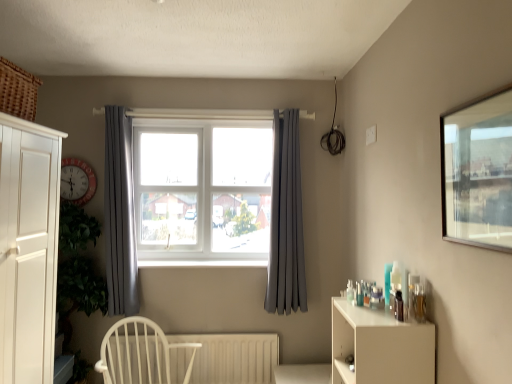
Question: Is white wood chair at lower left outside white plastic radiator at lower center?

Choices:
 (A) yes
 (B) no

Answer: (A)

Question: Is white wood chair at lower left with white plastic radiator at lower center?

Choices:
 (A) yes
 (B) no

Answer: (A)

Question: Is white wood chair at lower left turned away from white plastic radiator at lower center?

Choices:
 (A) yes
 (B) no

Answer: (A)

Question: Is white wood chair at lower left bigger than white plastic radiator at lower center?

Choices:
 (A) yes
 (B) no

Answer: (A)

Question: Does white wood chair at lower left have a greater width compared to white plastic radiator at lower center?

Choices:
 (A) no
 (B) yes

Answer: (B)

Question: Could you tell me if white wood chair at lower left is turned towards white plastic radiator at lower center?

Choices:
 (A) no
 (B) yes

Answer: (A)

Question: Is white plastic window at center far from white plastic radiator at lower center?

Choices:
 (A) no
 (B) yes

Answer: (A)

Question: Considering the relative positions of white plastic window at center and white plastic radiator at lower center in the image provided, is white plastic window at center in front of white plastic radiator at lower center?

Choices:
 (A) no
 (B) yes

Answer: (A)

Question: Can you confirm if white plastic window at center is wider than white plastic radiator at lower center?

Choices:
 (A) no
 (B) yes

Answer: (B)

Question: Does white plastic window at center have a larger size compared to white plastic radiator at lower center?

Choices:
 (A) yes
 (B) no

Answer: (A)

Question: Is white plastic window at center facing away from white plastic radiator at lower center?

Choices:
 (A) yes
 (B) no

Answer: (B)

Question: Could you tell me if white plastic window at center is turned towards white plastic radiator at lower center?

Choices:
 (A) yes
 (B) no

Answer: (B)

Question: From the image's perspective, is white wood chair at lower left located beneath satin grey curtain at center, which appears as the 1th curtain when viewed from the right?

Choices:
 (A) no
 (B) yes

Answer: (B)